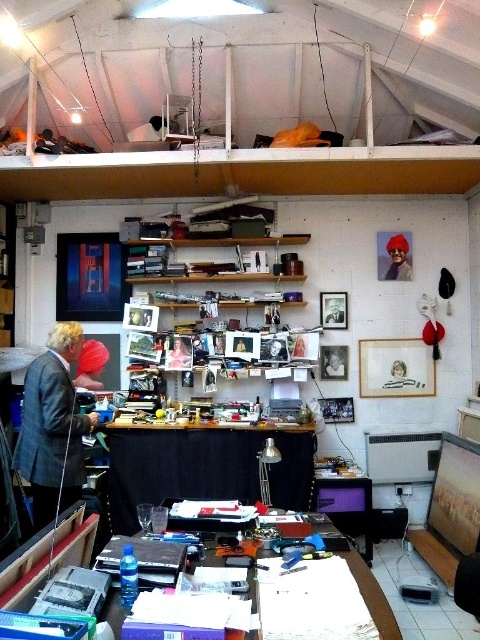
You are an artist who needs to move a 7.5 feet long sculpture from the corner of the room to a spot between the matte red hat at upper right and the matte black laptop at upper left. Will the sculpture fit in the space between them?

The distance between the matte red hat at upper right and the matte black laptop at upper left is 8.02 feet. Since the sculpture is 7.5 feet long, it will fit in the space between them as the available space is slightly larger than the sculpture.

In the scene shown: You are an interior designer planning to move a 1.5 meter tall sculpture into this workspace. The sculpture must be placed on either the black fabric table at center or the gray wool suit at left. Based on the height of the objects, which surface can safely support the sculpture without it toppling over?

The gray wool suit at left is taller than the black fabric table at center. Since the sculpture is 1.5 meters tall, placing it on the gray wool suit at left would provide a more stable base, as it can support the height better than the shorter table.

You are an artist trying to reach the matte black laptop at upper left on your desk but there is a matte red hat at upper right in the way. Can you move the hat to access the laptop?

The matte red hat at upper right is further to the viewer than the matte black laptop at upper left, so moving the hat would not block access to the laptop since it is closer to you.